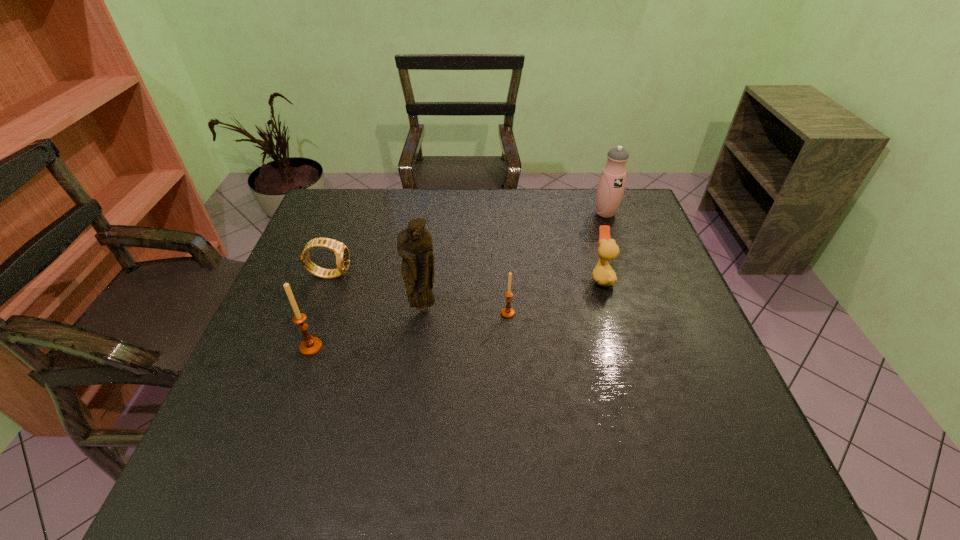
The height and width of the screenshot is (540, 960). Identify the location of vacant space that satisfies the following two spatial constraints: 1. on the beak of the fifth object from left to right; 2. on the front-facing side of the fourth object from right to left. (611, 308).

Image resolution: width=960 pixels, height=540 pixels. In order to click on free space that satisfies the following two spatial constraints: 1. on the face of the watch; 2. on the right side of the third object from right to left in this screenshot , I will do `click(316, 313)`.

You are a GUI agent. You are given a task and a screenshot of the screen. Output one action in this format:
    pyautogui.click(x=<x>, y=<y>)
    Task: Click on the vacant space that satisfies the following two spatial constraints: 1. on the face of the watch; 2. on the right side of the right candle_holder
    
    Given the screenshot: What is the action you would take?
    pyautogui.click(x=316, y=313)

You are a GUI agent. You are given a task and a screenshot of the screen. Output one action in this format:
    pyautogui.click(x=<x>, y=<y>)
    Task: Click on the free space that satisfies the following two spatial constraints: 1. on the face of the nearest object; 2. on the right side of the watch
    The width and height of the screenshot is (960, 540).
    Given the screenshot: What is the action you would take?
    pyautogui.click(x=303, y=347)